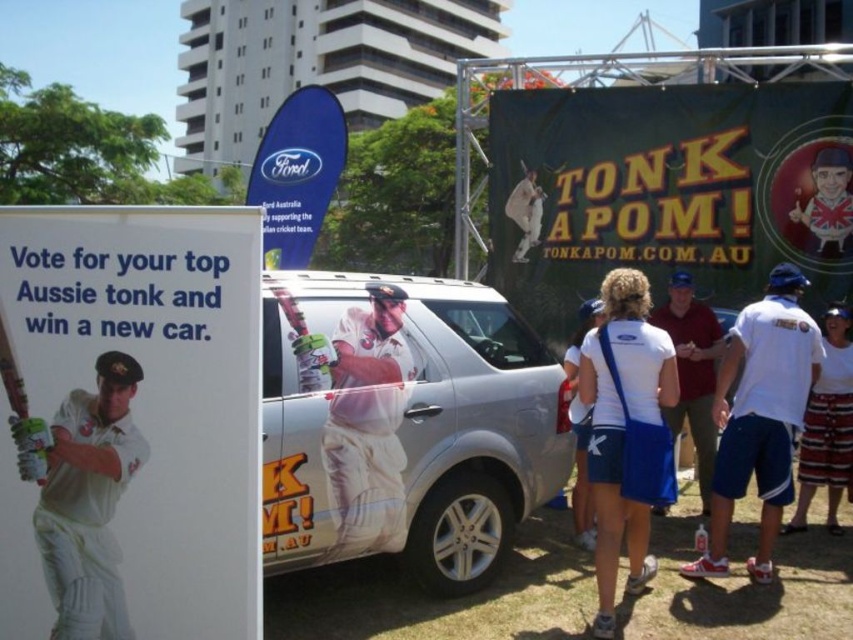
Question: Does white fabric bag at center appear under matte plastic baseball bat at upper right?

Choices:
 (A) no
 (B) yes

Answer: (B)

Question: Estimate the real-world distances between objects in this image. Which object is farther from the white fabric shorts at center?

Choices:
 (A) white fabric shirt at right
 (B) silver metallic car at center
 (C) striped shorts at lower right

Answer: (C)

Question: Which object is closer to the camera taking this photo?

Choices:
 (A) white fabric at center
 (B) white fabric shirt at center

Answer: (A)

Question: Considering the real-world distances, which object is farthest from the white fabric shorts at center?

Choices:
 (A) white matte cricket uniform at center
 (B) wooden bat at left
 (C) white fabric at center

Answer: (B)

Question: From the image, what is the correct spatial relationship of white matte cricket uniform at center in relation to wooden bat at left?

Choices:
 (A) left
 (B) right

Answer: (B)

Question: Does white cloth uniform at center come behind white fabric shirt at center?

Choices:
 (A) no
 (B) yes

Answer: (A)